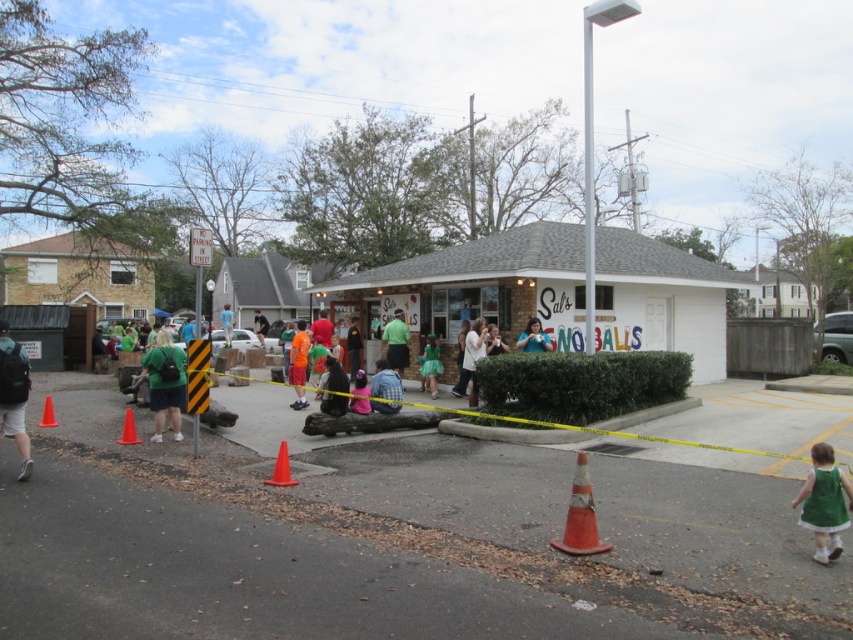
Looking at this image, does white cotton shirt at center appear over orange plastic traffic cone at lower center?

Correct, white cotton shirt at center is located above orange plastic traffic cone at lower center.

Between point (469, 404) and point (285, 465), which one is positioned behind?

Positioned behind is point (469, 404).

The image size is (853, 640). I want to click on white cotton shirt at center, so click(473, 355).

Does green satin dress at lower right appear on the right side of matte green dress at center?

Correct, you'll find green satin dress at lower right to the right of matte green dress at center.

Based on the photo, is green satin dress at lower right closer to camera compared to matte green dress at center?

Yes, it is in front of matte green dress at center.

Measure the distance between point (846, 520) and camera.

Point (846, 520) is 5.50 meters away from camera.

At what (x,y) coordinates should I click in order to perform the action: click on green satin dress at lower right. Please return your answer as a coordinate pair (x, y). Looking at the image, I should click on (824, 502).

Which is below, green matte shirt at center or green fabric shirt at center?

green matte shirt at center is lower down.

Does green matte shirt at center come behind green fabric shirt at center?

No, green matte shirt at center is in front of green fabric shirt at center.

Between point (398, 310) and point (222, 308), which one is positioned in front?

Positioned in front is point (398, 310).

Locate an element on the screen. This screenshot has height=640, width=853. green matte shirt at center is located at coordinates (396, 342).